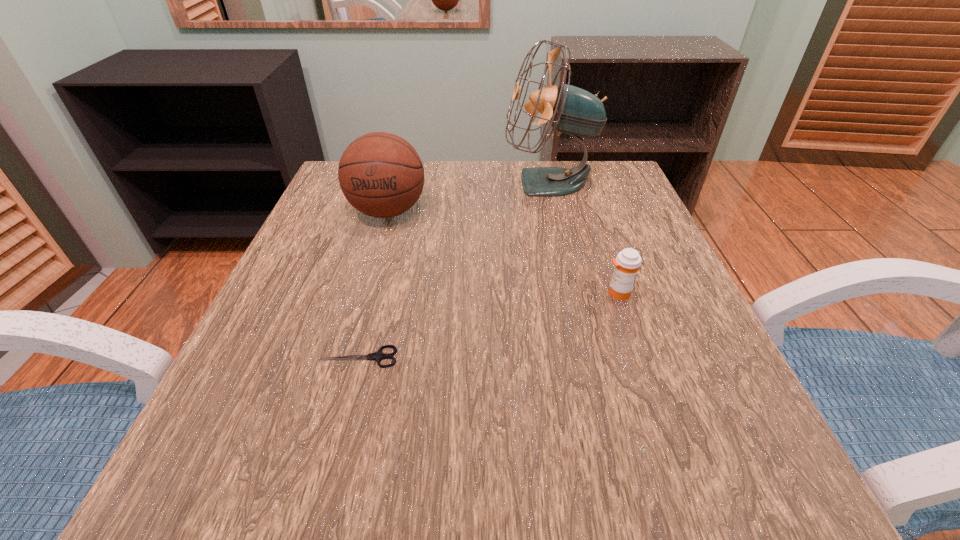
Where is `free space at the far edge`? free space at the far edge is located at coordinates (519, 163).

Find the location of a particular element. vacant space at the left edge of the desktop is located at coordinates point(275,431).

Identify the location of vacant space at the right edge of the desktop. This screenshot has height=540, width=960. (583, 215).

What are the coordinates of `vacant space at the near left corner` in the screenshot? It's located at (286, 482).

Where is `free space at the far right corner of the desktop`? This screenshot has width=960, height=540. free space at the far right corner of the desktop is located at coordinates (579, 163).

At what (x,y) coordinates should I click in order to perform the action: click on blank area at the near right corner. Please return your answer as a coordinate pair (x, y). The width and height of the screenshot is (960, 540). Looking at the image, I should click on [x=693, y=509].

Find the location of `unoccupied area between the shortest object and the tallest object`. unoccupied area between the shortest object and the tallest object is located at coordinates (454, 270).

At what (x,y) coordinates should I click in order to perform the action: click on free space between the medicine and the nearest object. Please return your answer as a coordinate pair (x, y). This screenshot has height=540, width=960. Looking at the image, I should click on (489, 325).

This screenshot has height=540, width=960. I want to click on vacant space that is in between the nearest object and the third shortest object, so (x=373, y=284).

Where is `empty space between the nearest object and the tallest object`? The image size is (960, 540). empty space between the nearest object and the tallest object is located at coordinates (454, 270).